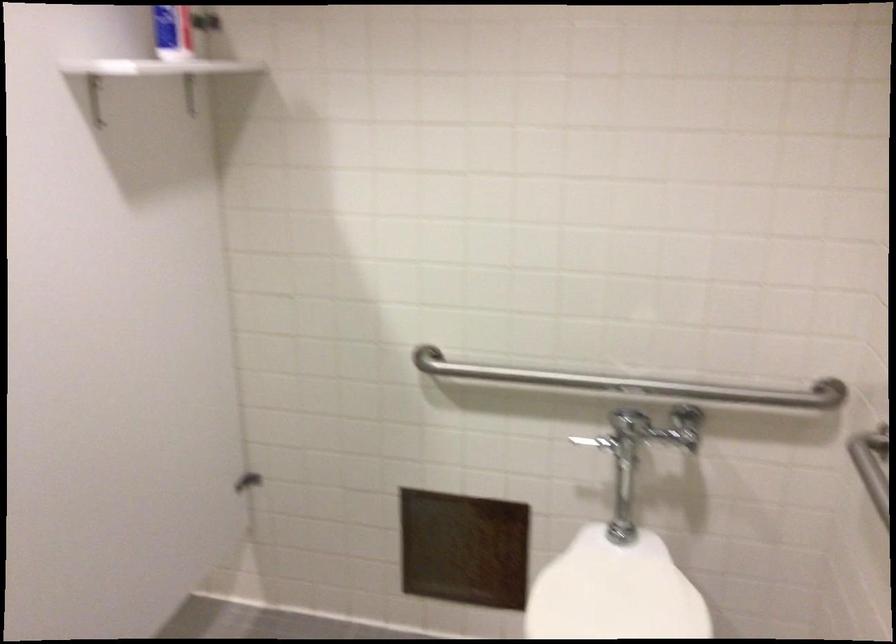
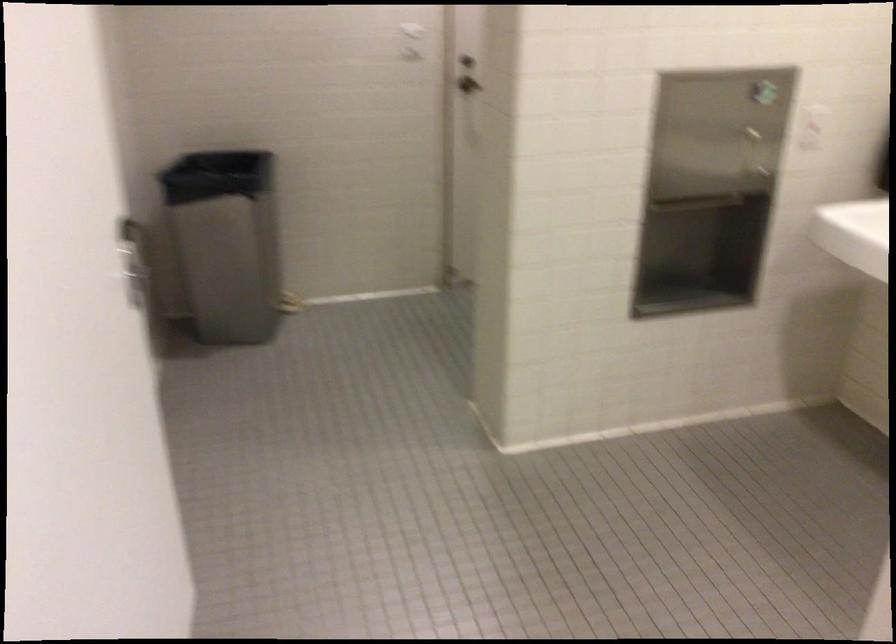
Question: The camera is either moving clockwise (left) or counter-clockwise (right) around the object. The first image is from the beginning of the video and the second image is from the end. Is the camera moving left or right when shooting the video?

Choices:
 (A) Left
 (B) Right

Answer: (B)